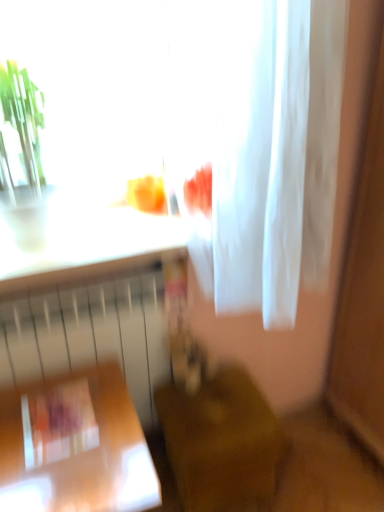
Identify the location of vacant area that lies to the right of matte plastic book at lower left. Image resolution: width=384 pixels, height=512 pixels. (112, 424).